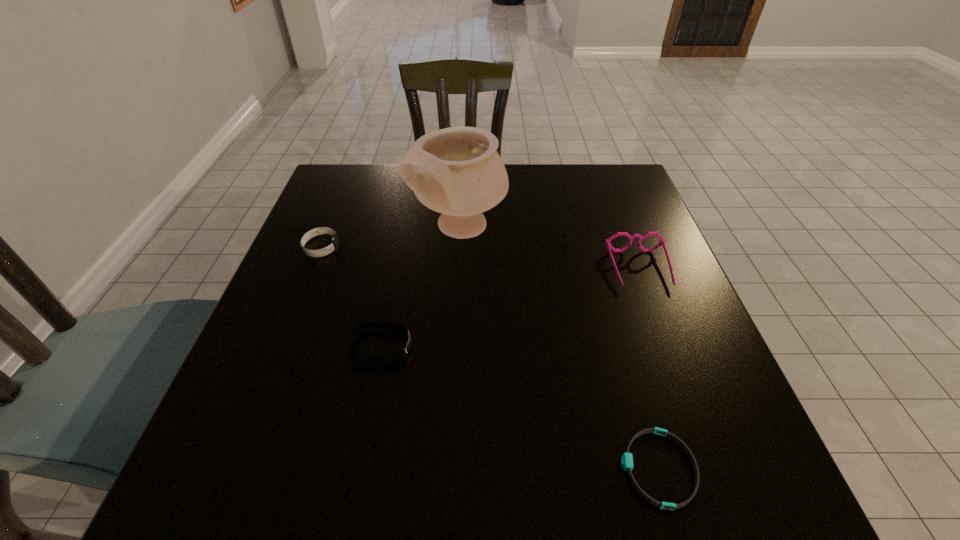
This screenshot has height=540, width=960. I want to click on object at the near right corner, so click(x=627, y=460).

Image resolution: width=960 pixels, height=540 pixels. In order to click on vacant space at the far edge of the desktop in this screenshot , I will do `click(392, 172)`.

Locate an element on the screen. This screenshot has width=960, height=540. free region at the left edge is located at coordinates (271, 305).

In the image, there is a desktop. Find the location of `free space at the right edge`. free space at the right edge is located at coordinates (667, 346).

The image size is (960, 540). What are the coordinates of `free space at the far left corner` in the screenshot? It's located at (356, 208).

At what (x,y) coordinates should I click in order to perform the action: click on vacant space at the far right corner. Please return your answer as a coordinate pair (x, y). Looking at the image, I should click on (579, 192).

You are a GUI agent. You are given a task and a screenshot of the screen. Output one action in this format:
    pyautogui.click(x=<x>, y=<y>)
    Task: Click on the free space between the second shortest object and the spectacles
    Image resolution: width=960 pixels, height=540 pixels.
    Given the screenshot: What is the action you would take?
    pyautogui.click(x=510, y=308)

The width and height of the screenshot is (960, 540). Identify the location of free spot between the tallest object and the spectacles. (550, 249).

Find the location of `free space between the shortest object and the fourth farthest object`. free space between the shortest object and the fourth farthest object is located at coordinates (519, 408).

The image size is (960, 540). I want to click on free space between the third tallest object and the second tallest object, so click(480, 258).